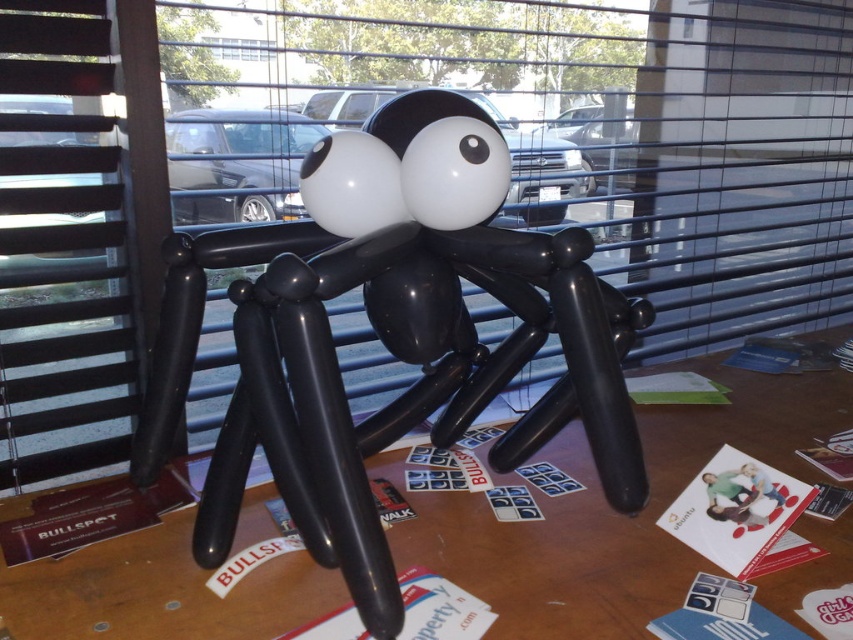
Question: Can you confirm if black rubber balloon spider at center is bigger than black matte balloon spider at center?

Choices:
 (A) yes
 (B) no

Answer: (B)

Question: Which point appears farthest from the camera in this image?

Choices:
 (A) (143, 576)
 (B) (399, 605)

Answer: (A)

Question: Does black rubber balloon spider at center appear on the left side of black matte balloon spider at center?

Choices:
 (A) yes
 (B) no

Answer: (A)

Question: Which point is farther from the camera taking this photo?

Choices:
 (A) (599, 346)
 (B) (401, 484)

Answer: (B)

Question: Which point appears farthest from the camera in this image?

Choices:
 (A) (704, 422)
 (B) (618, 442)

Answer: (A)

Question: Is black rubber balloon spider at center to the left of black matte balloon spider at center from the viewer's perspective?

Choices:
 (A) yes
 (B) no

Answer: (A)